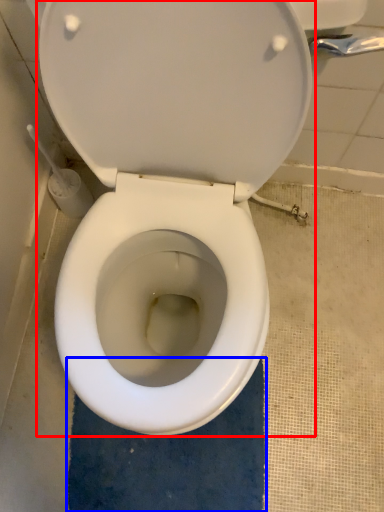
Question: Which of the following is the farthest to the observer, toilet (highlighted by a red box) or bath mat (highlighted by a blue box)?

Choices:
 (A) toilet
 (B) bath mat

Answer: (B)